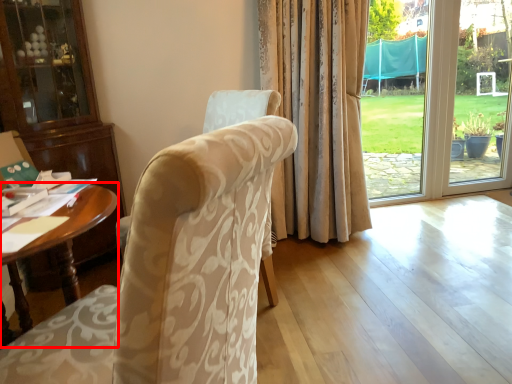
Question: From the image's perspective, what is the correct spatial relationship of desk (annotated by the red box) in relation to chair?

Choices:
 (A) below
 (B) above

Answer: (A)